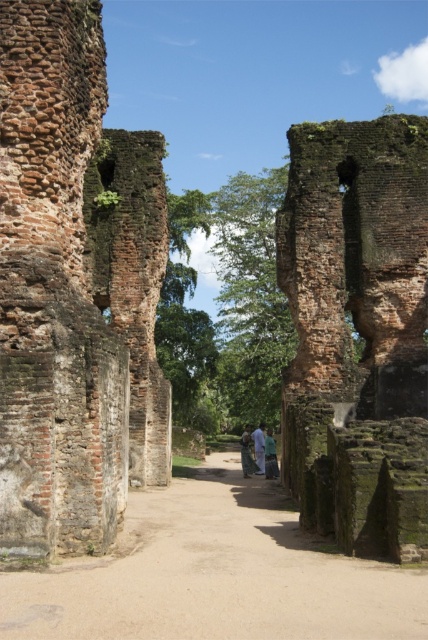
Question: Which point is farther from the camera taking this photo?

Choices:
 (A) (252, 454)
 (B) (259, 460)

Answer: (A)

Question: Is rusty brick wall at right below brown dirt path at center?

Choices:
 (A) yes
 (B) no

Answer: (B)

Question: Can you confirm if rusty brick wall at right is wider than brown dirt path at center?

Choices:
 (A) yes
 (B) no

Answer: (B)

Question: Among these points, which one is farthest from the camera?

Choices:
 (A) (259, 422)
 (B) (146, 602)
 (C) (369, 556)

Answer: (A)

Question: Which is farther from the rusty brick wall at right?

Choices:
 (A) green fabric pants at center
 (B) green fabric person at center
 (C) green fabric dress at center

Answer: (C)

Question: Can you confirm if rusty brick wall at right is positioned above green fabric dress at center?

Choices:
 (A) no
 (B) yes

Answer: (B)